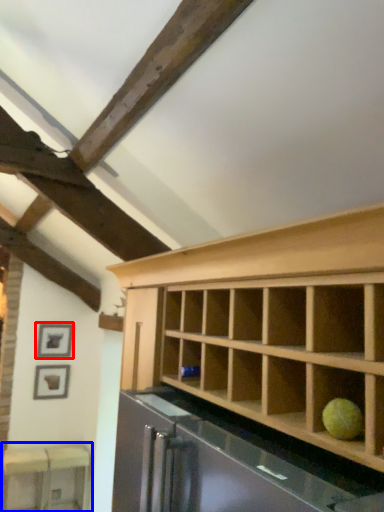
Question: Among these objects, which one is nearest to the camera, picture frame (highlighted by a red box) or table (highlighted by a blue box)?

Choices:
 (A) picture frame
 (B) table

Answer: (B)